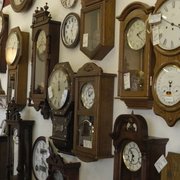
I want to click on double clock, so click(169, 37), click(173, 78).